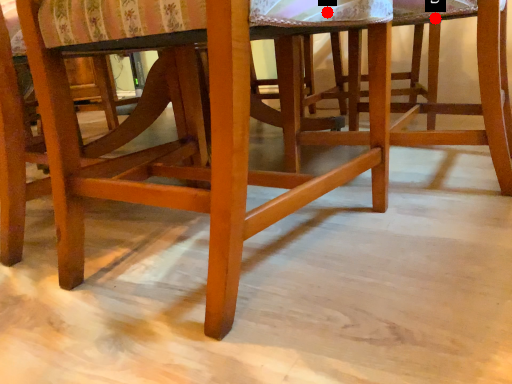
Question: Two points are circled on the image, labeled by A and B beside each circle. Which point is closer to the camera?

Choices:
 (A) A is closer
 (B) B is closer

Answer: (A)